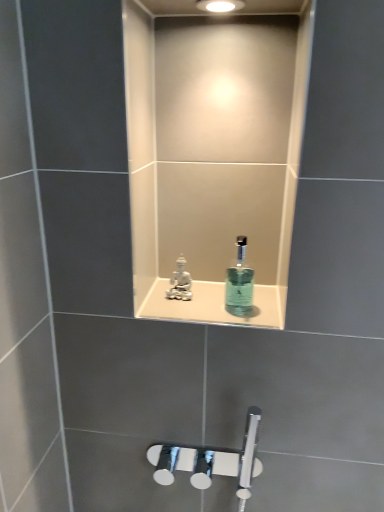
Question: Is white glossy statue at center facing towards white porcelain figurine at center?

Choices:
 (A) no
 (B) yes

Answer: (A)

Question: Is white glossy statue at center outside of white porcelain figurine at center?

Choices:
 (A) yes
 (B) no

Answer: (A)

Question: From the image's perspective, does white glossy statue at center appear lower than white porcelain figurine at center?

Choices:
 (A) yes
 (B) no

Answer: (A)

Question: Are white glossy statue at center and white porcelain figurine at center far apart?

Choices:
 (A) no
 (B) yes

Answer: (A)

Question: Considering the relative sizes of white glossy statue at center and white porcelain figurine at center in the image provided, is white glossy statue at center bigger than white porcelain figurine at center?

Choices:
 (A) no
 (B) yes

Answer: (B)

Question: Considering the relative positions of white glossy statue at center and white porcelain figurine at center in the image provided, is white glossy statue at center to the right of white porcelain figurine at center from the viewer's perspective?

Choices:
 (A) no
 (B) yes

Answer: (B)

Question: Is translucent glass mouthwash at center not inside white glossy statue at center?

Choices:
 (A) no
 (B) yes

Answer: (B)

Question: Does translucent glass mouthwash at center have a greater width compared to white glossy statue at center?

Choices:
 (A) no
 (B) yes

Answer: (A)

Question: Does translucent glass mouthwash at center have a lesser height compared to white glossy statue at center?

Choices:
 (A) yes
 (B) no

Answer: (B)

Question: Is translucent glass mouthwash at center bigger than white glossy statue at center?

Choices:
 (A) yes
 (B) no

Answer: (A)

Question: From a real-world perspective, is translucent glass mouthwash at center over white glossy statue at center?

Choices:
 (A) yes
 (B) no

Answer: (A)

Question: Considering the relative sizes of translucent glass mouthwash at center and white glossy statue at center in the image provided, is translucent glass mouthwash at center thinner than white glossy statue at center?

Choices:
 (A) yes
 (B) no

Answer: (A)

Question: Does white glossy statue at center have a greater width compared to translucent glass mouthwash at center?

Choices:
 (A) yes
 (B) no

Answer: (A)